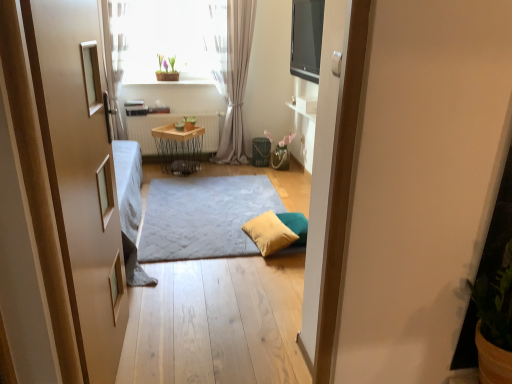
Question: Does point (229, 36) appear closer or farther from the camera than point (162, 155)?

Choices:
 (A) farther
 (B) closer

Answer: (B)

Question: Considering the positions of light gray sheer curtain at center and wooden/metallic table at center in the image, is light gray sheer curtain at center wider or thinner than wooden/metallic table at center?

Choices:
 (A) wide
 (B) thin

Answer: (B)

Question: Estimate the real-world distances between objects in this image. Which object is farther from the light gray sheer curtain at center?

Choices:
 (A) green matte pot at upper center
 (B) wooden door at left
 (C) soft gray carpet at center
 (D) wooden/metallic table at center
 (E) translucent glass window at upper center

Answer: (B)

Question: Which of these objects is positioned farthest from the soft gray carpet at center?

Choices:
 (A) yellow fabric pillow at center
 (B) green matte pot at upper center
 (C) light gray sheer curtain at center
 (D) translucent glass window at upper center
 (E) wooden radiator at center

Answer: (B)